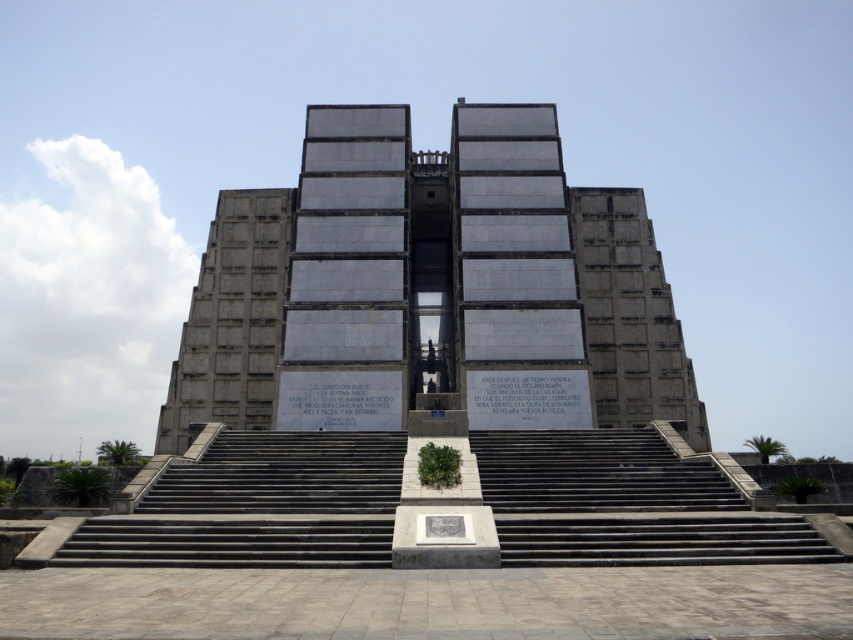
Can you confirm if gray concrete pyramid at center is positioned to the left of gray concrete stairs at center?

Yes, gray concrete pyramid at center is to the left of gray concrete stairs at center.

Consider the image. Does gray concrete pyramid at center have a smaller size compared to gray concrete stairs at center?

No.

Which is in front, point (619, 387) or point (332, 541)?

Point (332, 541) is in front.

At what (x,y) coordinates should I click in order to perform the action: click on gray concrete pyramid at center. Please return your answer as a coordinate pair (x, y). Looking at the image, I should click on (431, 289).